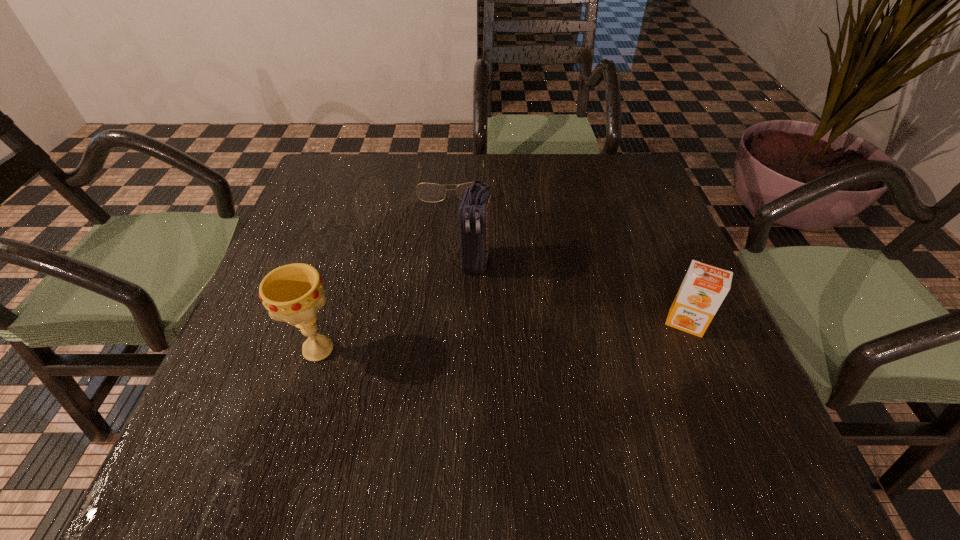
I want to click on chalice, so click(293, 293).

You are a GUI agent. You are given a task and a screenshot of the screen. Output one action in this format:
    pyautogui.click(x=<x>, y=<y>)
    Task: Click on the rightmost object
    
    Given the screenshot: What is the action you would take?
    pyautogui.click(x=704, y=287)

Identify the location of the third tallest object. (704, 287).

Identify the location of the shortest object. (428, 192).

Locate an element on the screen. This screenshot has height=540, width=960. spectacles is located at coordinates (428, 192).

Image resolution: width=960 pixels, height=540 pixels. What are the coordinates of `the third nearest object` in the screenshot? It's located at (474, 213).

Where is `free spot located on the right of the chalice`? free spot located on the right of the chalice is located at coordinates (516, 349).

You are a GUI agent. You are given a task and a screenshot of the screen. Output one action in this format:
    pyautogui.click(x=<x>, y=<y>)
    Task: Click on the vacant region located 0.130m on the left of the second shortest object
    
    Given the screenshot: What is the action you would take?
    click(598, 323)

Where is `vacant space situated on the front-facing side of the farthest object`? Image resolution: width=960 pixels, height=540 pixels. vacant space situated on the front-facing side of the farthest object is located at coordinates (452, 222).

Find the location of a particular element. free spot located 0.240m on the front-facing side of the farthest object is located at coordinates (453, 269).